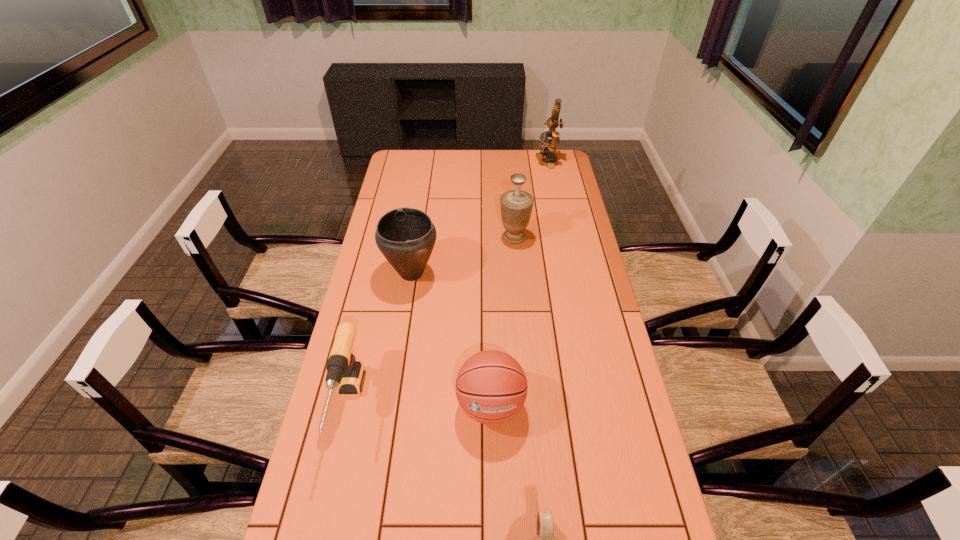
The image size is (960, 540). Identify the location of blank space at the right edge of the desktop. (604, 335).

The width and height of the screenshot is (960, 540). Identify the location of vacant space at the far left corner. (425, 161).

What are the coordinates of `vacant region at the far right corner` in the screenshot? It's located at (566, 163).

This screenshot has height=540, width=960. In order to click on free space between the leftmost urn and the drill in this screenshot , I will do `click(380, 339)`.

You are a GUI agent. You are given a task and a screenshot of the screen. Output one action in this format:
    pyautogui.click(x=<x>, y=<y>)
    Task: Click on the free spot between the basketball and the tallest object
    
    Given the screenshot: What is the action you would take?
    pyautogui.click(x=519, y=284)

Locate an element on the screen. This screenshot has width=960, height=540. vacant space in between the basketball and the microscope is located at coordinates (519, 284).

Locate an element on the screen. The width and height of the screenshot is (960, 540). vacant space in between the fourth nearest object and the drill is located at coordinates (380, 339).

This screenshot has height=540, width=960. In order to click on vacant space in between the drill and the microscope in this screenshot , I will do `click(448, 284)`.

Identify the location of free point between the drill and the second farthest object. (431, 321).

You are a GUI agent. You are given a task and a screenshot of the screen. Output one action in this format:
    pyautogui.click(x=<x>, y=<y>)
    Task: Click on the vacant region between the tallest object and the fourth nearest object
    
    Given the screenshot: What is the action you would take?
    pyautogui.click(x=480, y=218)